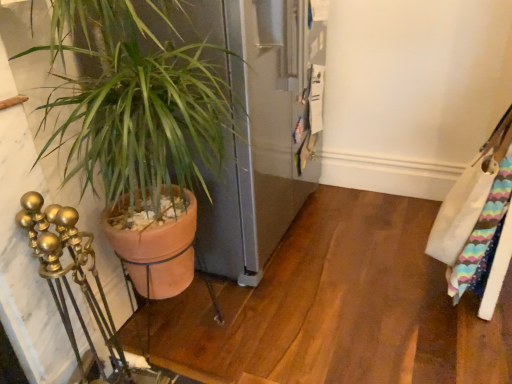
At what (x,y) coordinates should I click in order to perform the action: click on free point to the right of terracotta pot at left. Please return your answer as a coordinate pair (x, y). This screenshot has height=384, width=512. Looking at the image, I should click on (338, 323).